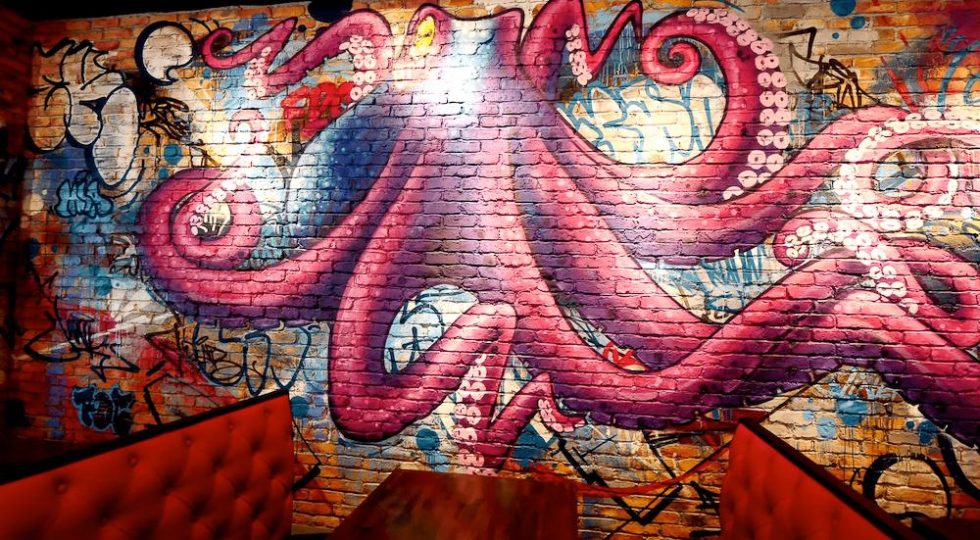
This screenshot has height=540, width=980. In order to click on table in this screenshot , I will do `click(509, 489)`.